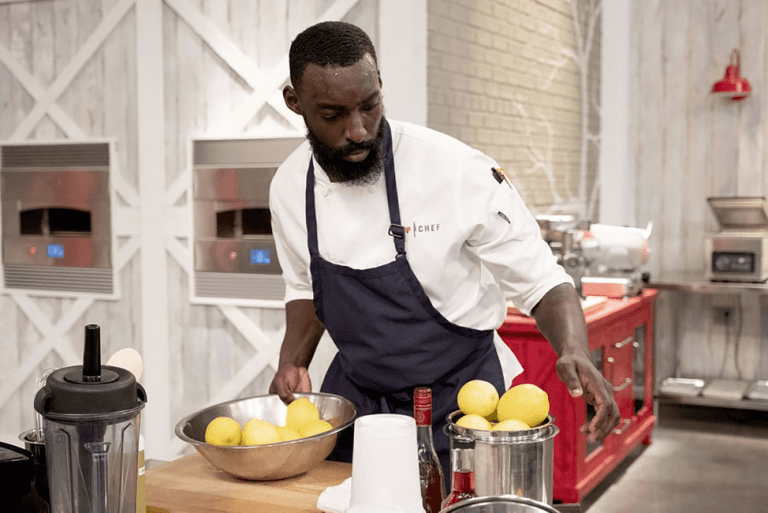
Where is `chopping board`? Image resolution: width=768 pixels, height=513 pixels. chopping board is located at coordinates (230, 495).